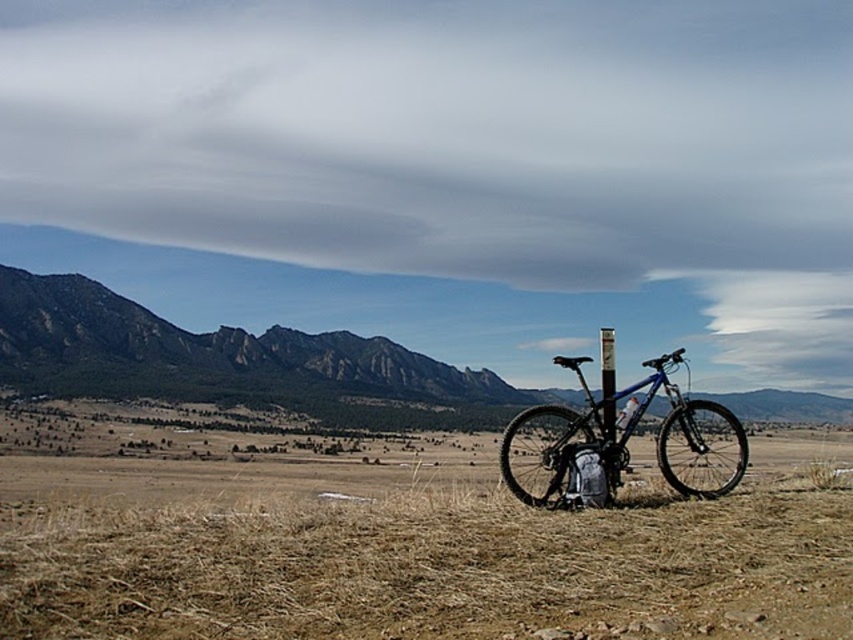
From the picture: You are a hiker planning to take a photo of the rugged brown mountain at left and the blue matte bicycle at center. Which object should you focus on first to ensure both are in the frame?

You should focus on the rugged brown mountain at left first because it is closer to you than the blue matte bicycle at center, so adjusting the camera to include it ensures the bicycle will also be in the frame.

You are a hiker planning to take a photo of the rugged brown mountain at left and the blue matte bicycle at center. From your current position, which object will appear larger in the photo?

The rugged brown mountain at left will appear larger in the photo because it is positioned over the blue matte bicycle at center, indicating it is closer to the camera and thus appears bigger.

You are a hiker planning to take a photo of the rugged brown mountain at left and the blue matte bicycle at center. Which object should you focus on first if you want to capture both in a single frame without moving the camera?

You should focus on the rugged brown mountain at left first because it is taller than the blue matte bicycle at center, so adjusting focus to the mountain ensures both are in the frame.